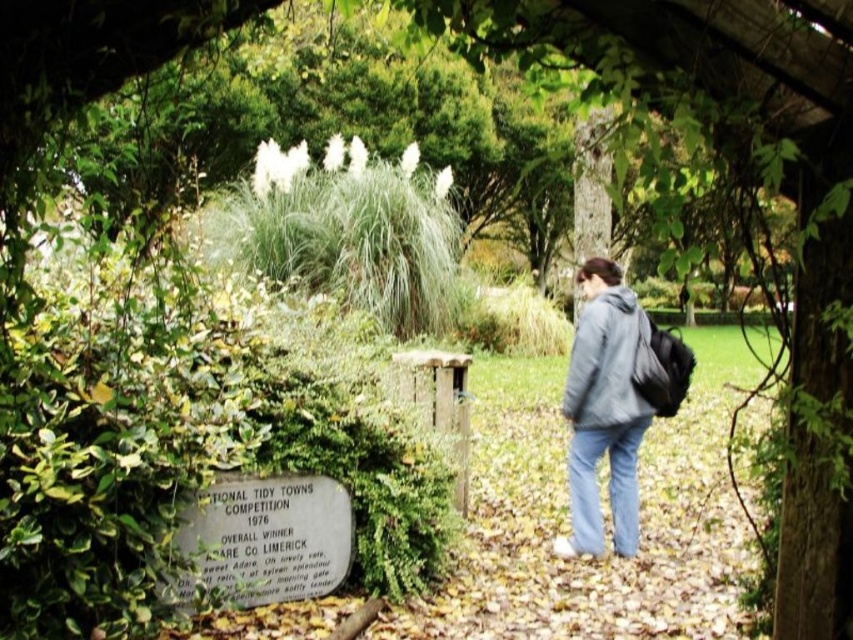
Does gray fleece jacket at right appear on the left side of blue denim jeans at lower center?

Indeed, gray fleece jacket at right is positioned on the left side of blue denim jeans at lower center.

Is point (589, 545) positioned after point (595, 520)?

That is False.

The width and height of the screenshot is (853, 640). Find the location of `gray fleece jacket at right`. gray fleece jacket at right is located at coordinates (602, 412).

Is gray fleece jacket at center positioned behind blue denim jeans at lower center?

That is False.

Is gray fleece jacket at center taller than blue denim jeans at lower center?

Indeed, gray fleece jacket at center has a greater height compared to blue denim jeans at lower center.

Is point (637, 321) behind point (596, 522)?

No.

At what (x,y) coordinates should I click in order to perform the action: click on gray fleece jacket at center. Please return your answer as a coordinate pair (x, y). The width and height of the screenshot is (853, 640). Looking at the image, I should click on (605, 362).

Can you confirm if gray fleece jacket at right is positioned to the right of gray fleece jacket at center?

Incorrect, gray fleece jacket at right is not on the right side of gray fleece jacket at center.

Is gray fleece jacket at right to the left of gray fleece jacket at center from the viewer's perspective?

Yes, gray fleece jacket at right is to the left of gray fleece jacket at center.

Between point (621, 442) and point (624, 392), which one is positioned in front?

Positioned in front is point (624, 392).

At what (x,y) coordinates should I click in order to perform the action: click on gray fleece jacket at right. Please return your answer as a coordinate pair (x, y). This screenshot has height=640, width=853. Looking at the image, I should click on (602, 412).